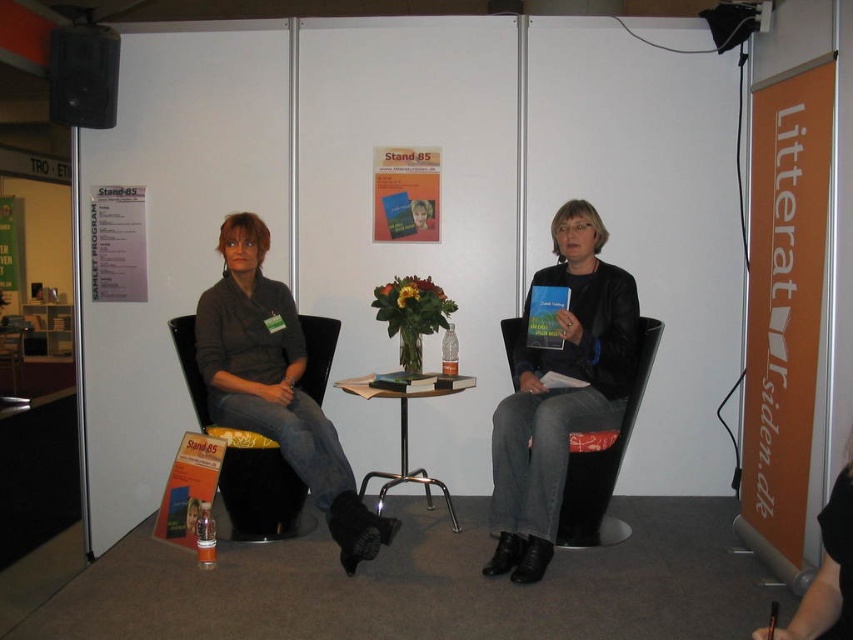
Question: Among these objects, which one is nearest to the camera?

Choices:
 (A) black fabric chair at left
 (B) wooden table at center

Answer: (A)

Question: Is matte black sweater at center further to camera compared to black fabric chair at left?

Choices:
 (A) yes
 (B) no

Answer: (B)

Question: Based on their relative distances, which object is nearer to the black fabric chair at left?

Choices:
 (A) wooden table at center
 (B) black matte speaker at upper left
 (C) black plastic chair at center
 (D) matte black sweater at center

Answer: (D)

Question: Does matte black sweater at center appear over black plastic chair at center?

Choices:
 (A) no
 (B) yes

Answer: (B)

Question: Is matte black sweater at center further to the viewer compared to wooden table at center?

Choices:
 (A) yes
 (B) no

Answer: (B)

Question: Which of the following is the farthest from the observer?

Choices:
 (A) (283, 509)
 (B) (426, 472)
 (C) (585, 538)
 (D) (219, 280)

Answer: (B)